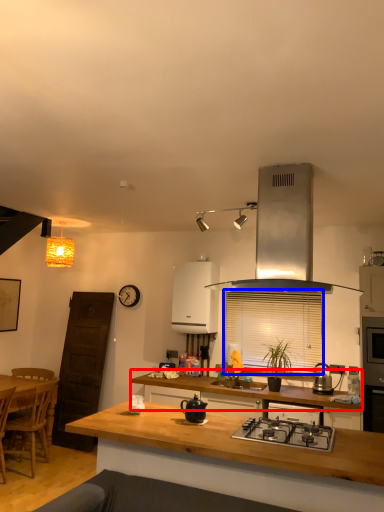
Question: Which object is closer to the camera taking this photo, cabinetry (highlighted by a red box) or window screen (highlighted by a blue box)?

Choices:
 (A) cabinetry
 (B) window screen

Answer: (A)